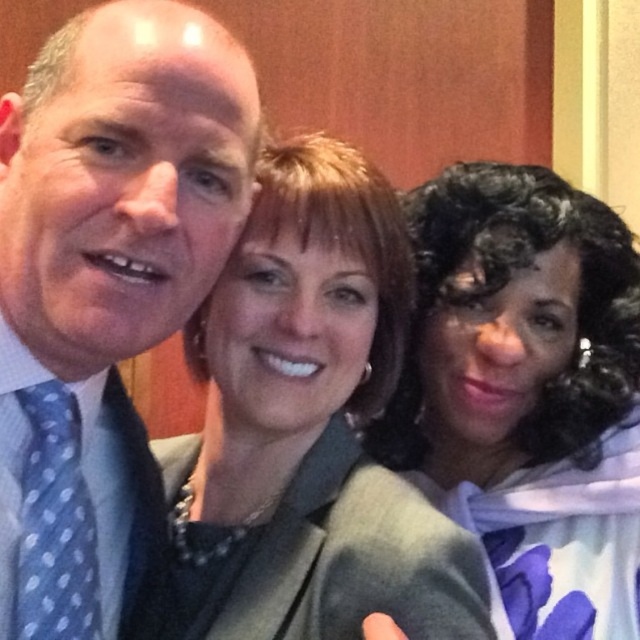
Question: Which object is closer to the camera taking this photo?

Choices:
 (A) green wool blazer at center
 (B) matte gray blazer at center
 (C) curly hair at center

Answer: (B)

Question: Which object appears closest to the camera in this image?

Choices:
 (A) blue dotted tie at left
 (B) matte gray blazer at center
 (C) blue polka dot tie at left
 (D) green wool blazer at center

Answer: (A)

Question: Does curly hair at center appear on the left side of blue polka dot tie at left?

Choices:
 (A) yes
 (B) no

Answer: (B)

Question: Can you confirm if curly hair at center is positioned to the left of green wool blazer at center?

Choices:
 (A) yes
 (B) no

Answer: (B)

Question: Does curly hair at center have a larger size compared to blue polka dot tie at left?

Choices:
 (A) yes
 (B) no

Answer: (A)

Question: Among these points, which one is farthest from the camera?

Choices:
 (A) (413, 636)
 (B) (35, 289)
 (C) (387, 412)
 (D) (104, 618)

Answer: (C)